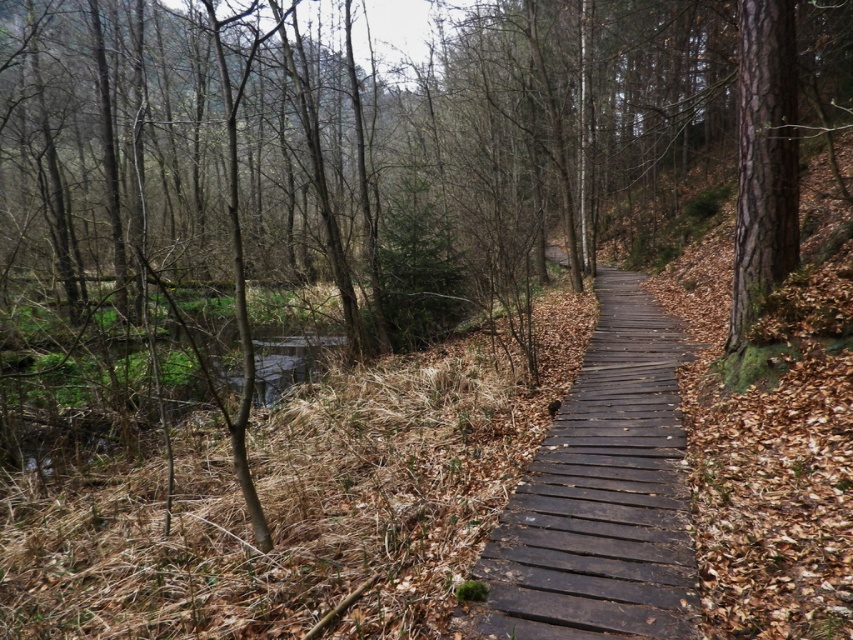
Looking at this image, you are a hiker who wants to take a photo of the dark brown wooden path at center and the smooth bark tree at right. Which object should you focus on first if you want to capture both in a single frame without moving the camera?

You should focus on the dark brown wooden path at center first because it is larger in size than the smooth bark tree at right, allowing it to be the main subject while still fitting the smaller tree into the frame.

You are a hiker carrying a large backpack and want to cross the dark brown wooden path at center. There is a smooth bark tree at right nearby. Can you walk through the space between them?

The dark brown wooden path at center might be wider than smooth bark tree at right, so it is uncertain whether there is enough space to walk through the gap between them. Check the actual width before proceeding.